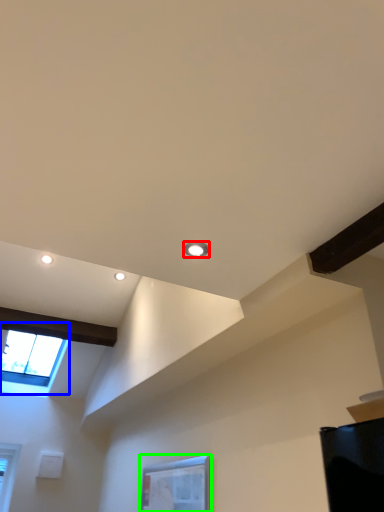
Question: Based on their relative distances, which object is farther from droplight (highlighted by a red box)? Choose from window (highlighted by a blue box) and window (highlighted by a green box).

Choices:
 (A) window
 (B) window

Answer: (A)